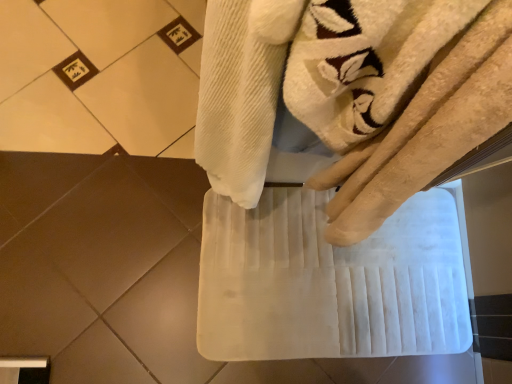
The height and width of the screenshot is (384, 512). What are the coordinates of `white fabric bath towel at center` in the screenshot? It's located at (329, 281).

What do you see at coordinates (329, 281) in the screenshot? I see `white fabric bath towel at center` at bounding box center [329, 281].

This screenshot has width=512, height=384. What are the coordinates of `white fabric bath towel at center` in the screenshot? It's located at (329, 281).